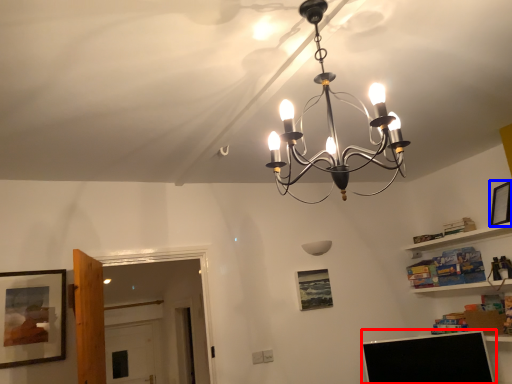
Question: Which object appears farthest to the camera in this image, computer monitor (highlighted by a red box) or picture frame (highlighted by a blue box)?

Choices:
 (A) computer monitor
 (B) picture frame

Answer: (B)